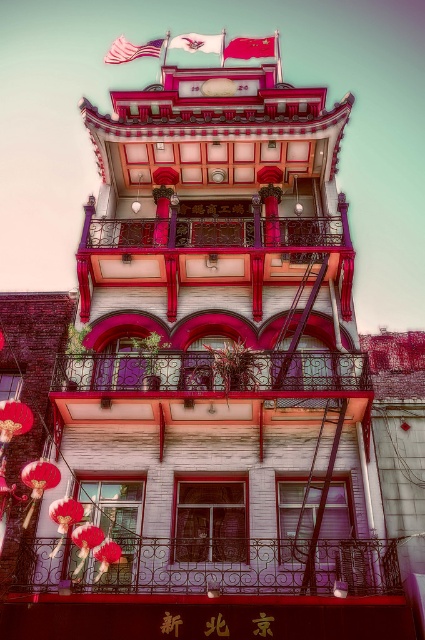
You are an architect analyzing the building facade. Which object would require more material to construct between the metallic wrought iron balcony at center and the silky fabric flag at upper center?

The metallic wrought iron balcony at center is larger in size than the silky fabric flag at upper center, so it would require more material to construct.

You are standing in front of the multi story building and want to locate the metallic wrought iron balcony at center. According to the coordinate system where the bottom left corner is the origin, can you determine its position?

The metallic wrought iron balcony at center is located at point (215,232) in the coordinate system, which means it is positioned approximately 36.4 percent from the left and 50.8 percent from the bottom of the image.

You are a window washer standing on the ground floor of the building. You need to clean both the metallic wrought iron balcony at center and the american flag at upper left. Which object will require you to climb higher to reach?

The american flag at upper left requires climbing higher because it is taller than the metallic wrought iron balcony at center.